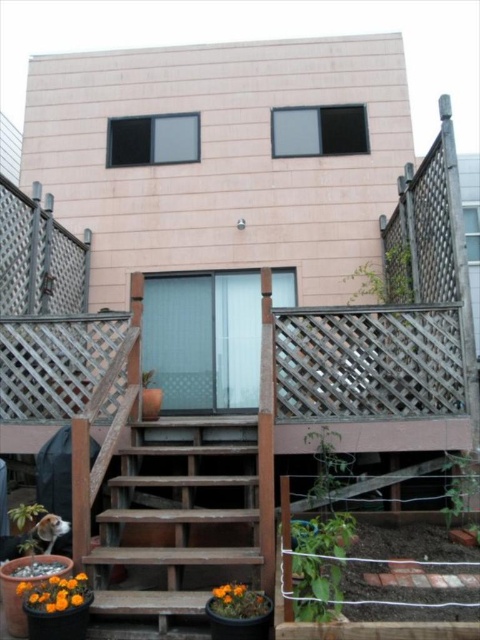
Can you confirm if green leafy plant at center is thinner than orange matte flower pot at lower center?

Incorrect, green leafy plant at center's width is not less than orange matte flower pot at lower center's.

Between point (316, 572) and point (224, 609), which one is positioned in front?

Positioned in front is point (316, 572).

Between point (336, 524) and point (223, 602), which one is positioned in front?

Point (223, 602) is more forward.

Find the location of a particular element. Image resolution: width=480 pixels, height=640 pixels. green leafy plant at center is located at coordinates (317, 534).

Between point (86, 595) and point (261, 611), which one is positioned behind?

The point (86, 595) is more distant.

This screenshot has height=640, width=480. What are the coordinates of `orange matte flower at lower left` in the screenshot? It's located at (56, 593).

Where is `wooden stairs at center`? wooden stairs at center is located at coordinates tap(179, 512).

Is wooden stairs at center in front of orange matte flower at lower left?

No, it is behind orange matte flower at lower left.

Who is more forward, (171,467) or (21,584)?

Point (21,584)

What are the coordinates of `wooden stairs at center` in the screenshot? It's located at (179, 512).